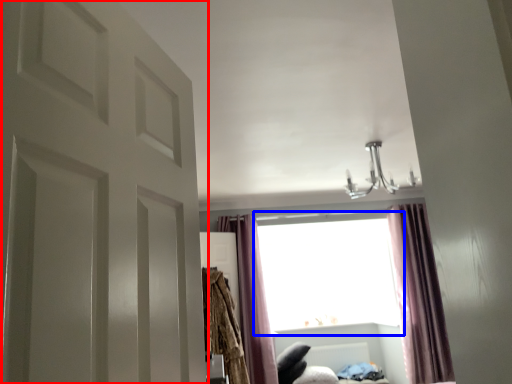
Question: Which object appears farthest to the camera in this image, door (highlighted by a red box) or window (highlighted by a blue box)?

Choices:
 (A) door
 (B) window

Answer: (B)